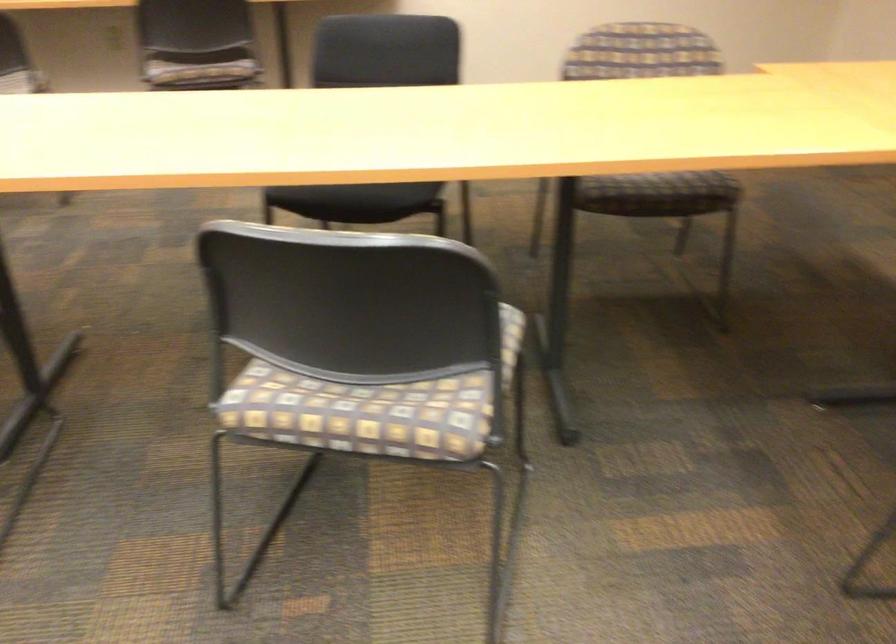
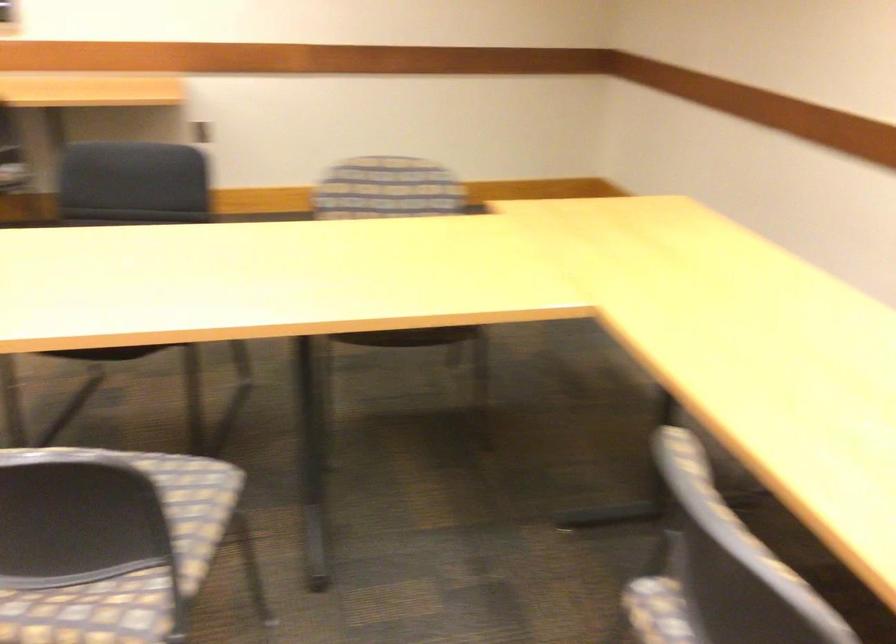
Find the pixel in the second image that matches point 371,218 in the first image.

(106, 353)